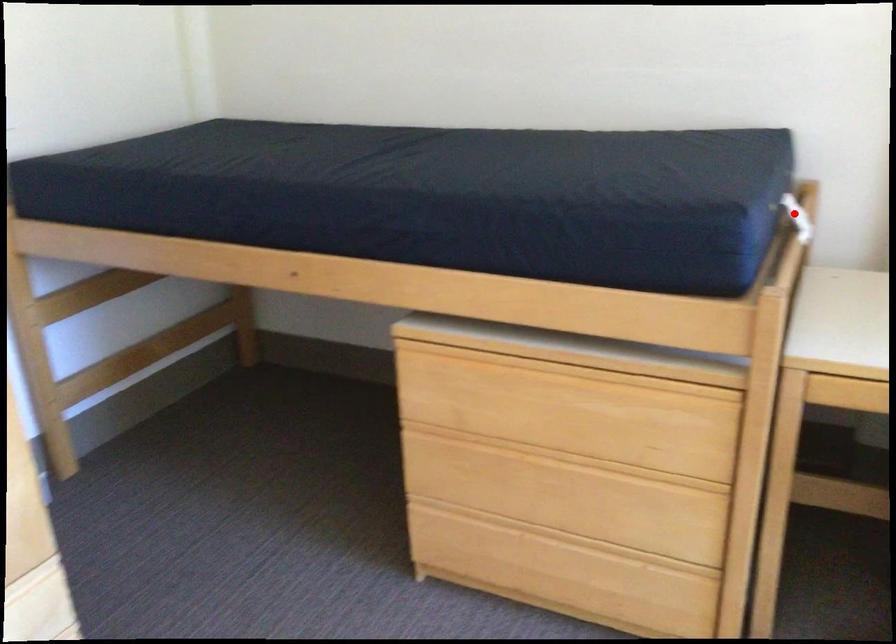
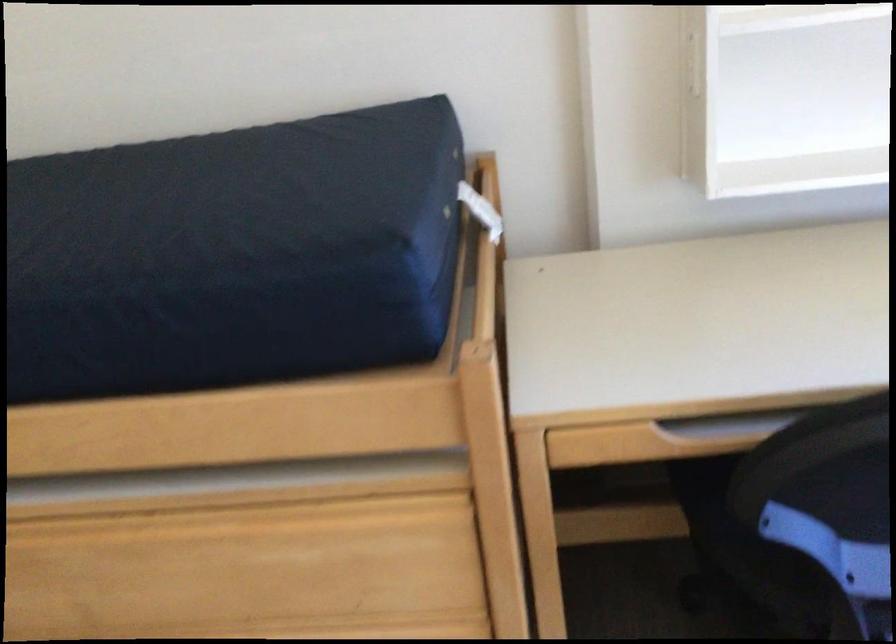
Question: I am providing you with two images of the same scene from different viewpoints. Given a red point in image1, look at the same physical point in image2. Is it:

Choices:
 (A) Closer to the viewpoint
 (B) Farther from the viewpoint

Answer: (A)